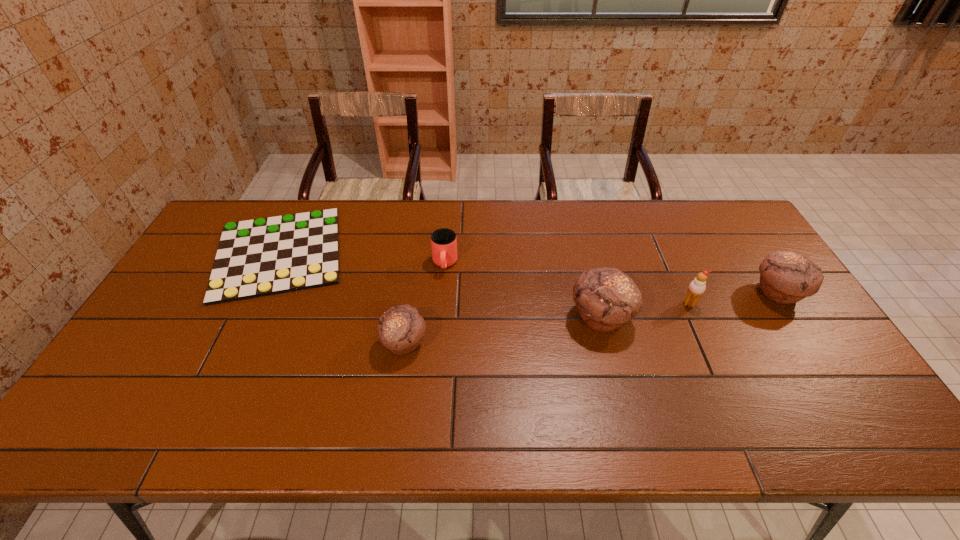
Where is `vacant area situated on the left of the rightmost object`? The image size is (960, 540). vacant area situated on the left of the rightmost object is located at coordinates (650, 293).

At what (x,y) coordinates should I click in order to perform the action: click on vacant area situated 0.330m on the right of the shortest object. Please return your answer as a coordinate pair (x, y). The height and width of the screenshot is (540, 960). Looking at the image, I should click on (452, 253).

Image resolution: width=960 pixels, height=540 pixels. Identify the location of vacant area situated at the front with a straw on the second object from right to left. (724, 380).

Locate an element on the screen. The width and height of the screenshot is (960, 540). vacant region located 0.120m on the handle side of the cup is located at coordinates (442, 306).

Identify the location of object that is at the far edge. tap(265, 256).

Where is `object located at the left edge`? The width and height of the screenshot is (960, 540). object located at the left edge is located at coordinates tap(265, 256).

Locate an element on the screen. The image size is (960, 540). object located in the right edge section of the desktop is located at coordinates (786, 277).

This screenshot has height=540, width=960. I want to click on object that is at the far left corner, so click(x=265, y=256).

In the image, there is a desktop. Where is `vacant space at the far edge`? vacant space at the far edge is located at coordinates (365, 202).

Identify the location of vacant space at the near edge of the desktop. pyautogui.click(x=343, y=382).